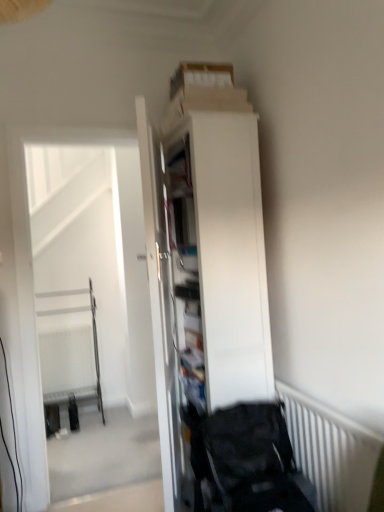
Question: In the image, is black fabric baby carriage at lower right on the left side or the right side of white matte cabinet at center?

Choices:
 (A) left
 (B) right

Answer: (B)

Question: Is black fabric baby carriage at lower right bigger or smaller than white matte cabinet at center?

Choices:
 (A) small
 (B) big

Answer: (A)

Question: Which object is the farthest from the white striped radiator at lower right?

Choices:
 (A) black fabric baby carriage at lower right
 (B) white glossy door at center
 (C) white matte cabinet at center

Answer: (B)

Question: Considering the real-world distances, which object is farthest from the white glossy door at center?

Choices:
 (A) black fabric baby carriage at lower right
 (B) white matte cabinet at center
 (C) white striped radiator at lower right

Answer: (C)